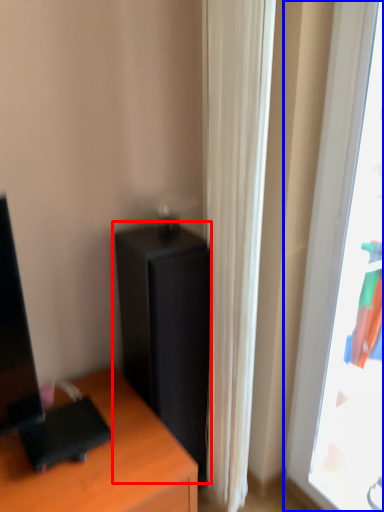
Question: Which of the following is the farthest to the observer, file cabinet (highlighted by a red box) or window (highlighted by a blue box)?

Choices:
 (A) file cabinet
 (B) window

Answer: (A)